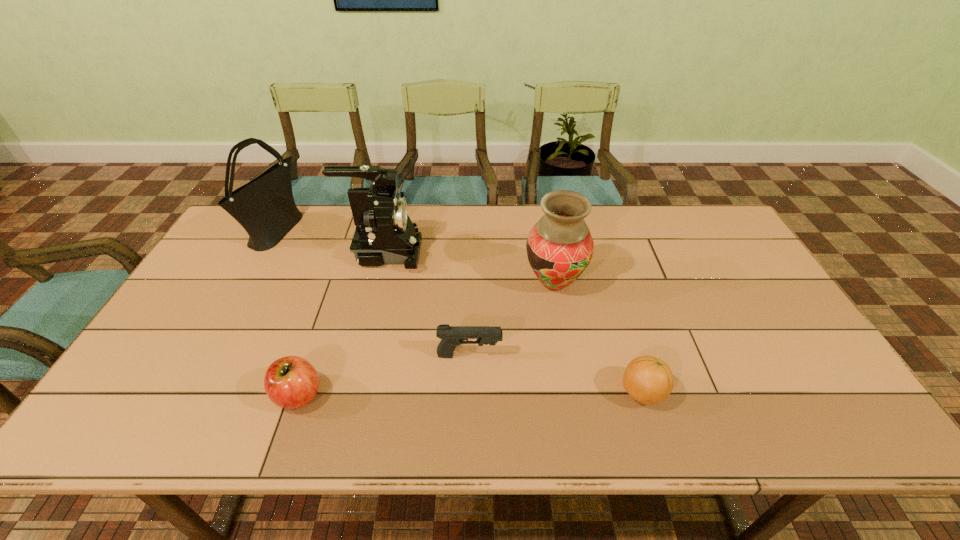
Find the location of a particular element. This screenshot has width=960, height=540. vacant region at the near edge of the desktop is located at coordinates (211, 413).

Locate an element on the screen. Image resolution: width=960 pixels, height=540 pixels. vacant space at the left edge of the desktop is located at coordinates (224, 259).

In the image, there is a desktop. Where is `free space at the right edge`? The height and width of the screenshot is (540, 960). free space at the right edge is located at coordinates (755, 274).

The image size is (960, 540). Identify the location of free spot at the near left corner of the desktop. (158, 412).

In order to click on free space that is in between the orange and the second object from right to left in this screenshot , I will do `click(598, 338)`.

Identify the location of free space between the fourth farthest object and the apple. (x=384, y=375).

Locate an element on the screen. The image size is (960, 540). free space between the camcorder and the apple is located at coordinates (341, 323).

Where is `free space between the rightmost object and the second object from right to left`? The height and width of the screenshot is (540, 960). free space between the rightmost object and the second object from right to left is located at coordinates (598, 338).

Locate an element on the screen. The image size is (960, 540). free space between the apple and the fourth farthest object is located at coordinates (384, 375).

Find the location of a particular element. This screenshot has width=960, height=540. free spot between the camcorder and the third object from right to left is located at coordinates (426, 304).